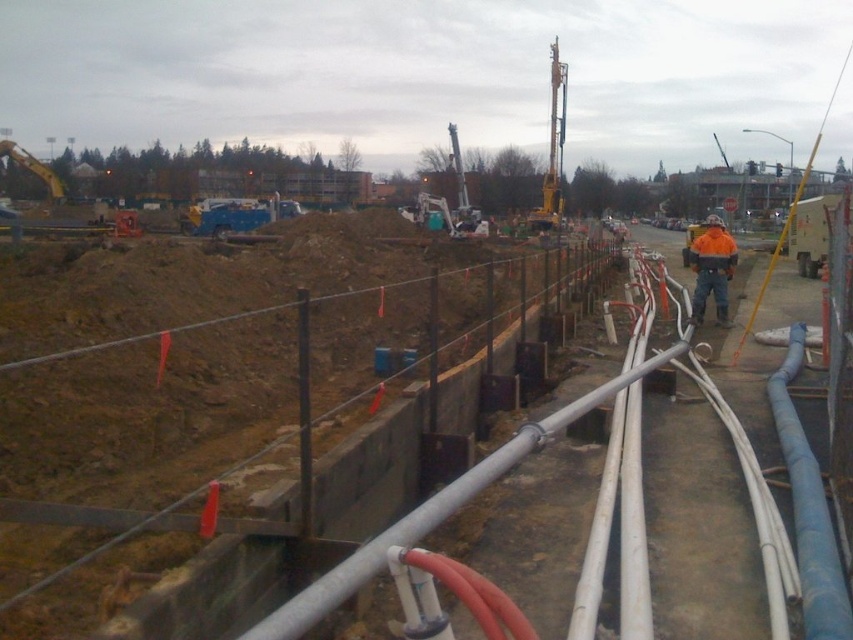
You are a construction worker who needs to lay a new cable that must avoid the blue rubber hose at center right. Based on the coordinates provided in the scene description, where should you place the cable to ensure it doesn not interfere with the hose?

The blue rubber hose at center right is located at point (809,509). To avoid it, the cable should be placed away from this coordinate, ensuring a safe distance from the hose.

You are a safety inspector at the construction site. You need to locate the point at coordinate (712, 268) on the image. Where exactly is this point located?

The point at coordinate (712, 268) is located on the orange reflective jacket at center.

You are a safety inspector standing at the trench fence. You need to reach the yellow metallic drill at upper center to check its safety. The orange reflective jacket at center belongs to a worker who is in your path. Can you safely walk straight to the drill without getting too close to the worker? The minimum safe distance required is 100 feet.

The orange reflective jacket at center is 119.32 feet away from the yellow metallic drill at upper center. Since the minimum safe distance is 100 feet, you can safely walk straight to the yellow metallic drill at upper center as the distance between you and the worker wearing the orange reflective jacket at center exceeds the required 100 feet.